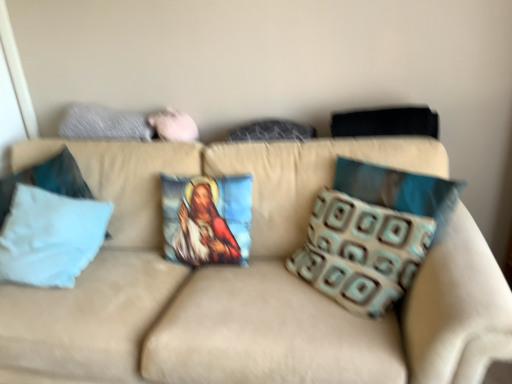
Question: Should I look upward or downward to see beige fabric couch at center?

Choices:
 (A) down
 (B) up

Answer: (A)

Question: Does textured fabric pillow at center, which is the third pillow in right-to-left order, turn towards textured gray pillow at upper left, the 3th pillow positioned from the left?

Choices:
 (A) no
 (B) yes

Answer: (A)

Question: Does textured fabric pillow at center, which is the third pillow in right-to-left order, have a lesser height compared to textured gray pillow at upper left, placed as the fifth pillow when sorted from right to left?

Choices:
 (A) no
 (B) yes

Answer: (B)

Question: From the image's perspective, is textured fabric pillow at center, which is the third pillow in right-to-left order, located above textured gray pillow at upper left, placed as the fifth pillow when sorted from right to left?

Choices:
 (A) yes
 (B) no

Answer: (B)

Question: Is textured fabric pillow at center, arranged as the fifth pillow when viewed from the left, bigger than textured gray pillow at upper left, placed as the fifth pillow when sorted from right to left?

Choices:
 (A) no
 (B) yes

Answer: (A)

Question: Does textured fabric pillow at center, which is the third pillow in right-to-left order, have a greater height compared to textured gray pillow at upper left, the 3th pillow positioned from the left?

Choices:
 (A) yes
 (B) no

Answer: (B)

Question: From the image's perspective, is textured fabric pillow at center, which is the third pillow in right-to-left order, located beneath textured gray pillow at upper left, placed as the fifth pillow when sorted from right to left?

Choices:
 (A) yes
 (B) no

Answer: (A)

Question: Is brown textured pillow at right, marked as the 2th pillow in a right-to-left arrangement, aimed at brown patterned pillow at right, marked as the 7th pillow in a left-to-right arrangement?

Choices:
 (A) yes
 (B) no

Answer: (B)

Question: Would you say brown textured pillow at right, the 6th pillow positioned from the left, is outside brown patterned pillow at right, marked as the 7th pillow in a left-to-right arrangement?

Choices:
 (A) no
 (B) yes

Answer: (B)

Question: Can you confirm if brown textured pillow at right, the 6th pillow positioned from the left, is shorter than brown patterned pillow at right, marked as the 7th pillow in a left-to-right arrangement?

Choices:
 (A) yes
 (B) no

Answer: (A)

Question: Is brown textured pillow at right, marked as the 2th pillow in a right-to-left arrangement, positioned behind brown patterned pillow at right, the 1th pillow positioned from the right?

Choices:
 (A) yes
 (B) no

Answer: (B)

Question: Is brown textured pillow at right, marked as the 2th pillow in a right-to-left arrangement, closer to the viewer compared to brown patterned pillow at right, marked as the 7th pillow in a left-to-right arrangement?

Choices:
 (A) no
 (B) yes

Answer: (B)

Question: From a real-world perspective, is brown textured pillow at right, the 6th pillow positioned from the left, beneath brown patterned pillow at right, marked as the 7th pillow in a left-to-right arrangement?

Choices:
 (A) yes
 (B) no

Answer: (A)

Question: Does white fabric pillow at left, arranged as the 1th pillow when viewed from the left, come in front of white fabric pillow at left, the 2th pillow in the left-to-right sequence?

Choices:
 (A) no
 (B) yes

Answer: (A)